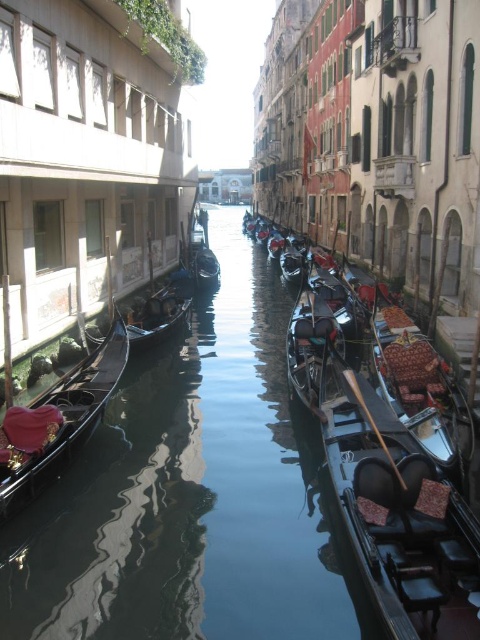
Question: Is shiny black gondola at center to the left of wooden gondola at center from the viewer's perspective?

Choices:
 (A) no
 (B) yes

Answer: (B)

Question: Which point is farther from the camera taking this photo?

Choices:
 (A) (269, 243)
 (B) (380, 314)

Answer: (A)

Question: Which of the following is the closest to the observer?

Choices:
 (A) shiny black gondola at center
 (B) polished wood gondola at center

Answer: (B)

Question: Is polished wood gondola at center wider than shiny black gondola at left?

Choices:
 (A) yes
 (B) no

Answer: (A)

Question: Is polished wood gondola at center thinner than shiny black gondola at left?

Choices:
 (A) no
 (B) yes

Answer: (A)

Question: Which of the following is the farthest from the observer?

Choices:
 (A) wooden gondola at center
 (B) shiny black gondola at center
 (C) polished wood gondola at center

Answer: (A)